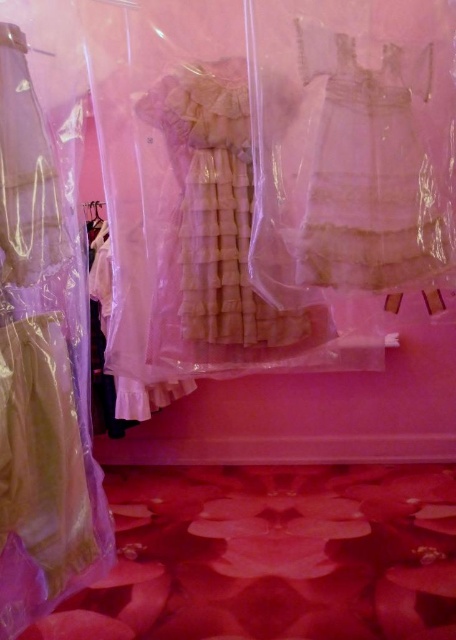
Question: Is the position of white lace dress at center more distant than that of light beige chiffon dress at center?

Choices:
 (A) yes
 (B) no

Answer: (B)

Question: Can you confirm if white lace dress at center is wider than light beige chiffon dress at center?

Choices:
 (A) yes
 (B) no

Answer: (B)

Question: Which point is closer to the camera?

Choices:
 (A) (74, 252)
 (B) (433, 250)
 (C) (166, 99)

Answer: (A)

Question: In this image, where is white lace dress at center located relative to light beige chiffon dress at center?

Choices:
 (A) above
 (B) below

Answer: (A)

Question: Considering the real-world distances, which object is farthest from the light beige chiffon dress at center?

Choices:
 (A) white lace dress at center
 (B) matte beige dress at center

Answer: (B)

Question: Which point is farther to the camera?

Choices:
 (A) white lace dress at center
 (B) matte beige dress at center
 (C) light beige chiffon dress at center

Answer: (C)